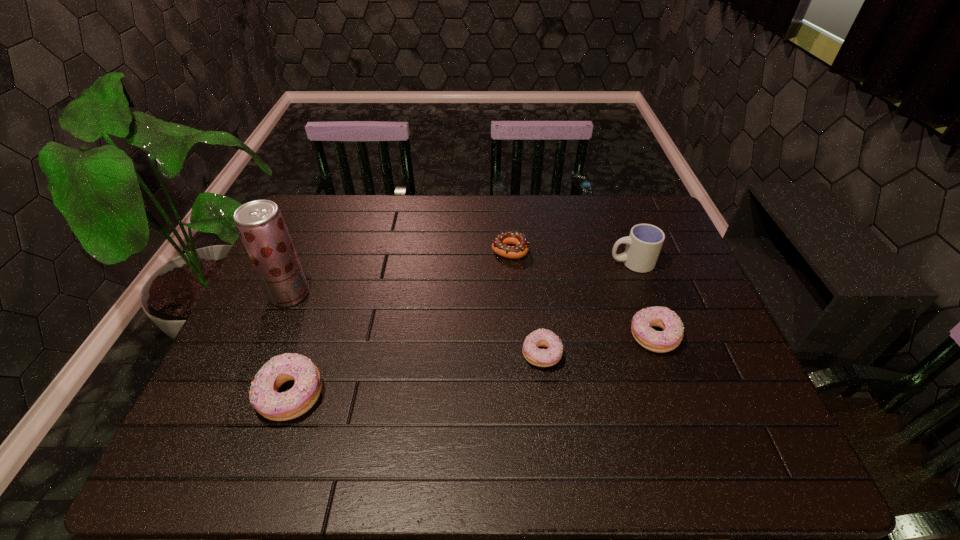
If equal spacing is the goal by inserting an additional doughnut among them, please point out a vacant space for this new doughnut. Please provide its 2D coordinates. Your answer should be formatted as a tuple, i.e. [(x, y)], where the tuple contains the x and y coordinates of a point satisfying the conditions above.

[(421, 374)]